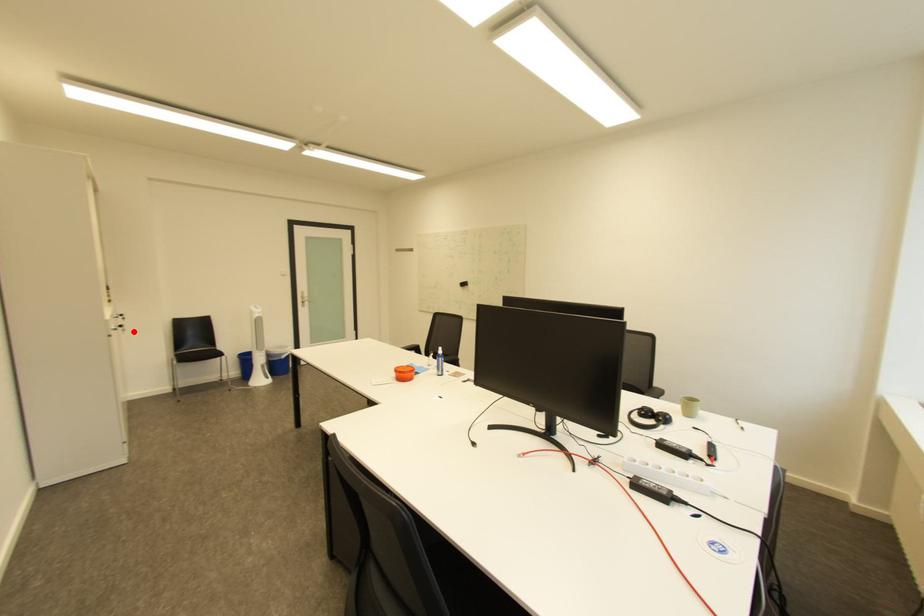
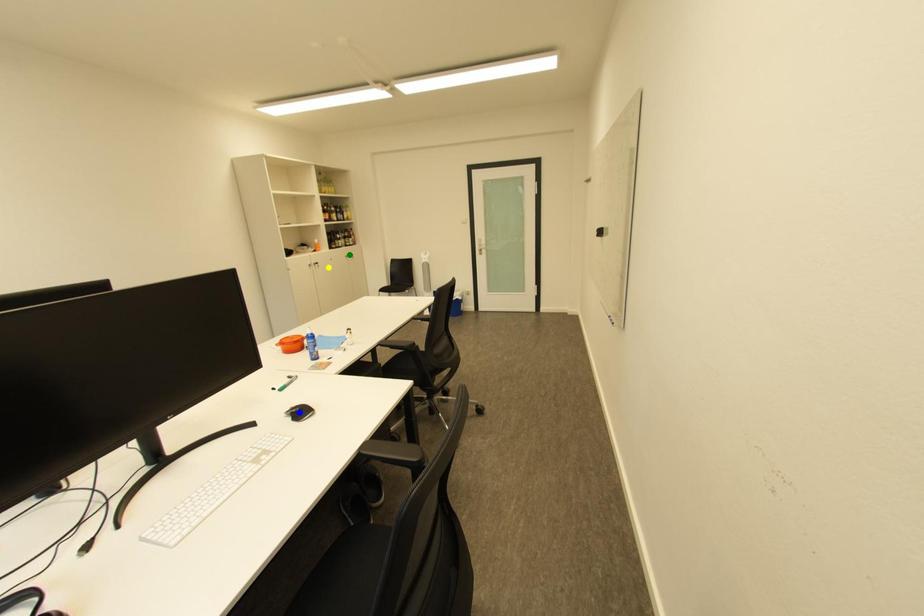
Question: I am providing you with two images of the same scene from different viewpoints. A red point is marked on the first image. You are given multiple points on the second image. Which spot in image 2 lines up with the point in image 1?

Choices:
 (A) yellow point
 (B) green point
 (C) blue point

Answer: (A)